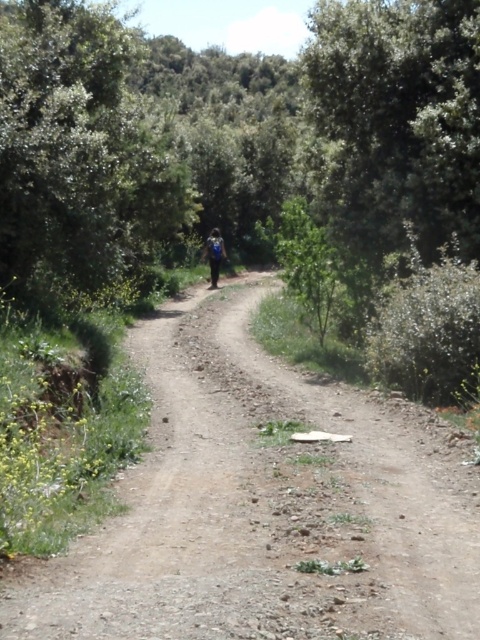
You are standing at the edge of the dirt road at center and want to walk towards the green leafy tree at upper left. Which direction should you head?

You should head to the left because the dirt road at center is to the right of the green leafy tree at upper left, so moving left will take you towards it.

In the scene shown: You are a hiker carrying a 2.5 meter long telescopic pole that needs to be fully extended. You come across the dirt road at center and the green leafy tree at upper left. Which object has a smaller width that might restrict the pole from passing through?

The dirt road at center has a smaller width than the green leafy tree at upper left, so it might restrict the pole from passing through.

You are a hiker standing at the start of the dirt road at center. You want to reach the green leafy tree at upper left. Which direction should you walk to get closer to the tree?

The dirt road at center is closer to the viewer than the green leafy tree at upper left. To reach the green leafy tree at upper left, you should walk forward along the dirt road at center since it leads towards the tree.